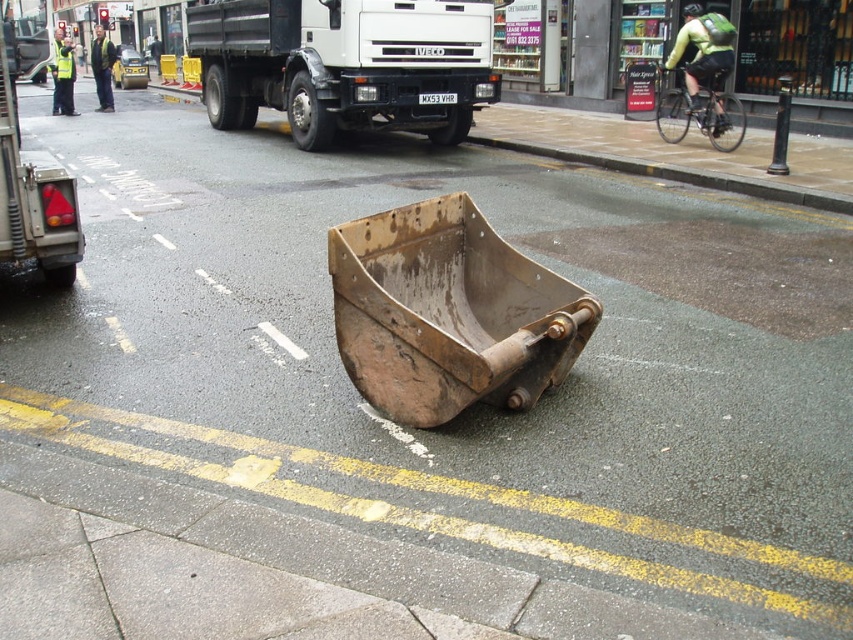
You are a pedestrian standing at the edge of the road where the large rusted metal bucket is placed. You see a green reflective jacket at upper right and a dark green jacket at upper left. Which jacket is farther from you?

The green reflective jacket at upper right is 16.00 meters from the dark green jacket at upper left. Since you are at the edge of the road where the bucket is, the jacket that is farther would depend on their positions. However, based on the given distance between them, if you are positioned between them, the one farther away would be the green reflective jacket at upper right if it is 16 meters away from the dark green jacket at upper left. But without knowing your exact position, it is hard to determine.

You are a delivery driver who needs to navigate around the brown wooden bucket at center and the high visibility yellow jacket at upper left. Which object is closer to the road surface?

The brown wooden bucket at center is closer to the road surface because it is located below the high visibility yellow jacket at upper left.